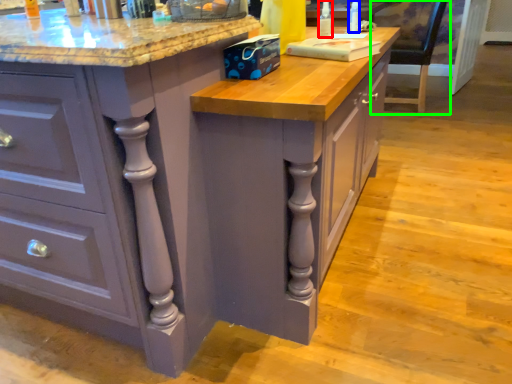
Question: Which object is positioned farthest from bottle (highlighted by a red box)? Select from bottle (highlighted by a blue box) and chair (highlighted by a green box).

Choices:
 (A) bottle
 (B) chair

Answer: (B)